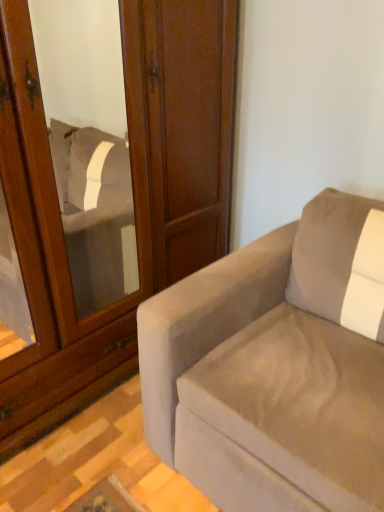
Question: Is suede-like beige couch at right taller or shorter than matte wood screen door at upper left?

Choices:
 (A) short
 (B) tall

Answer: (A)

Question: From the image's perspective, is suede-like beige couch at right positioned above or below matte wood screen door at upper left?

Choices:
 (A) below
 (B) above

Answer: (A)

Question: Considering their positions, is suede-like beige couch at right located in front of or behind matte wood screen door at upper left?

Choices:
 (A) behind
 (B) front

Answer: (B)

Question: Is matte wood screen door at upper left in front of or behind suede-like beige couch at right in the image?

Choices:
 (A) front
 (B) behind

Answer: (B)

Question: From their relative heights in the image, would you say matte wood screen door at upper left is taller or shorter than suede-like beige couch at right?

Choices:
 (A) tall
 (B) short

Answer: (A)

Question: Is point (99, 381) positioned closer to the camera than point (180, 309)?

Choices:
 (A) closer
 (B) farther

Answer: (B)

Question: Based on their sizes in the image, would you say matte wood screen door at upper left is bigger or smaller than suede-like beige couch at right?

Choices:
 (A) small
 (B) big

Answer: (B)